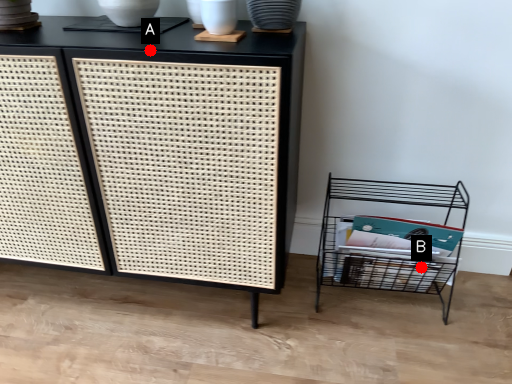
Question: Two points are circled on the image, labeled by A and B beside each circle. Which of the following is the farthest from the observer?

Choices:
 (A) A is further
 (B) B is further

Answer: (B)